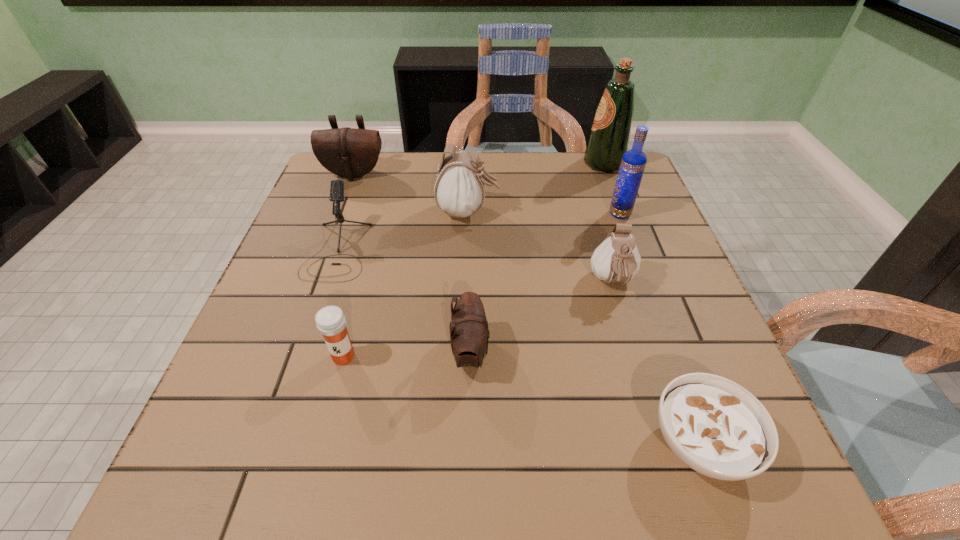
Find the location of a particular element. Image resolution: width=960 pixels, height=540 pixels. microphone is located at coordinates (337, 186).

The image size is (960, 540). Find the location of `the smaller brown pouch`. the smaller brown pouch is located at coordinates (469, 334).

Identify the location of the nearest pouch. This screenshot has width=960, height=540. (469, 334).

I want to click on medicine, so [330, 321].

The height and width of the screenshot is (540, 960). Identify the location of soup bowl. (715, 426).

The image size is (960, 540). I want to click on white soup bowl, so click(x=715, y=426).

This screenshot has width=960, height=540. Find the location of `free space located 0.350m on the front-facing side of the tallest object`. free space located 0.350m on the front-facing side of the tallest object is located at coordinates (465, 164).

I want to click on vacant space situated 0.110m on the front-facing side of the tallest object, so [x=546, y=164].

The image size is (960, 540). Find the location of `free spot located 0.050m on the front-facing side of the tallest object`. free spot located 0.050m on the front-facing side of the tallest object is located at coordinates (566, 164).

You are a GUI agent. You are given a task and a screenshot of the screen. Output one action in this format:
    pyautogui.click(x=<x>, y=<y>)
    Task: Click on the vacant region located on the back of the blue vodka
    
    Given the screenshot: What is the action you would take?
    pyautogui.click(x=600, y=161)